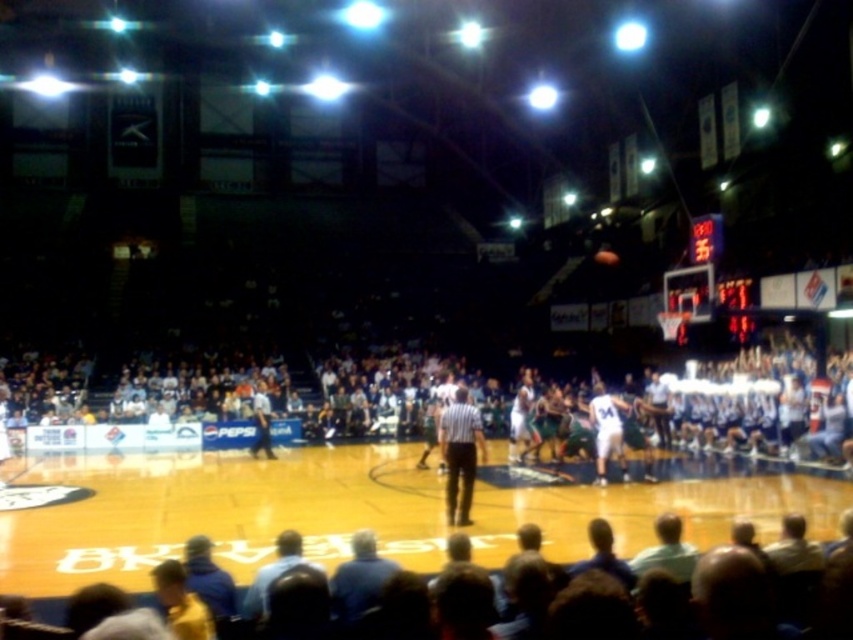
Which is more to the right, white jersey at center or shiny orange basketball at center?

shiny orange basketball at center is more to the right.

Measure the distance from white jersey at center to shiny orange basketball at center.

white jersey at center and shiny orange basketball at center are 32.47 meters apart from each other.

Between point (602, 394) and point (601, 260), which one is positioned in front?

Point (602, 394)

Where is `white jersey at center`? white jersey at center is located at coordinates (607, 432).

Between light blue shirt at lower center and white jersey at center, which one is positioned higher?

white jersey at center is above.

Between light blue shirt at lower center and white jersey at center, which one has more height?

white jersey at center is taller.

Describe the element at coordinates (767, 570) in the screenshot. I see `light blue shirt at lower center` at that location.

Where is `light blue shirt at lower center`? This screenshot has width=853, height=640. light blue shirt at lower center is located at coordinates (767, 570).

Between wooden polished basketball court at center and white jersey at center, which one has less height?

Standing shorter between the two is wooden polished basketball court at center.

From the picture: Who is more distant from viewer, (712, 506) or (598, 465)?

Point (598, 465)

The image size is (853, 640). In order to click on wooden polished basketball court at center in this screenshot , I will do `click(218, 513)`.